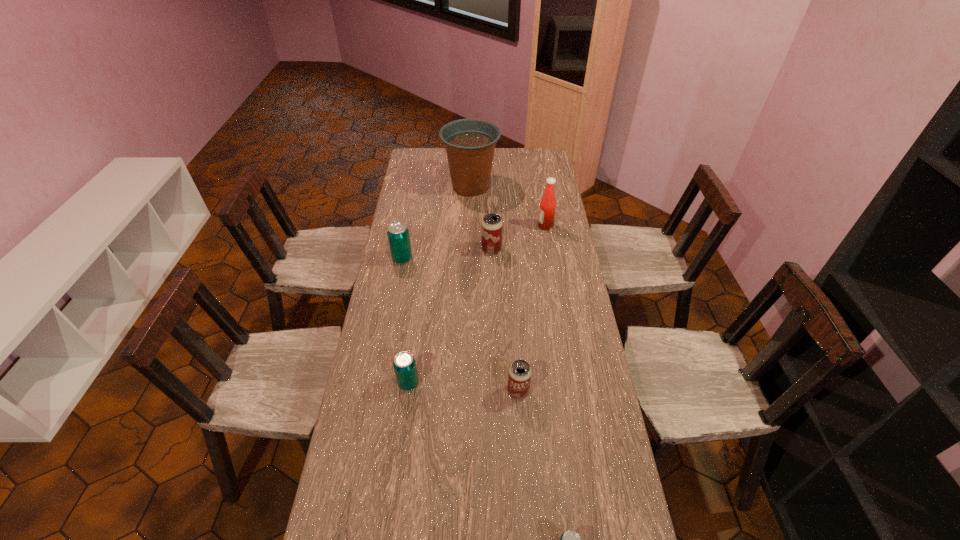
Locate an element on the screen. This screenshot has height=540, width=960. free space located on the front of the tallest object is located at coordinates (469, 238).

You are a GUI agent. You are given a task and a screenshot of the screen. Output one action in this format:
    pyautogui.click(x=<x>, y=<y>)
    Task: Click on the free point located on the front-facing side of the rightmost object
    
    Given the screenshot: What is the action you would take?
    pyautogui.click(x=462, y=226)

You are a GUI agent. You are given a task and a screenshot of the screen. Output one action in this format:
    pyautogui.click(x=<x>, y=<y>)
    Task: Click on the vacant region located 0.220m on the front-facing side of the rightmost object
    
    Given the screenshot: What is the action you would take?
    pyautogui.click(x=489, y=226)

Image resolution: width=960 pixels, height=540 pixels. What are the coordinates of `vacant space located on the front-facing side of the rightmost object` in the screenshot? It's located at (507, 226).

At what (x,y) coordinates should I click in order to perform the action: click on vacant space situated 0.320m on the back of the bigger red beer can. Please return your answer as a coordinate pair (x, y). Looking at the image, I should click on (490, 200).

This screenshot has width=960, height=540. I want to click on free spot located 0.090m on the front of the leftmost teal beer can, so click(x=398, y=281).

What are the coordinates of `blank space located on the back of the nearer red beer can` in the screenshot? It's located at (516, 356).

Locate an element on the screen. The width and height of the screenshot is (960, 540). vacant area situated on the right of the second smallest teal beer can is located at coordinates (463, 383).

Identify the location of object that is at the right edge. (546, 216).

The width and height of the screenshot is (960, 540). What are the coordinates of `vacant space at the left edge of the desktop` in the screenshot? It's located at (368, 528).